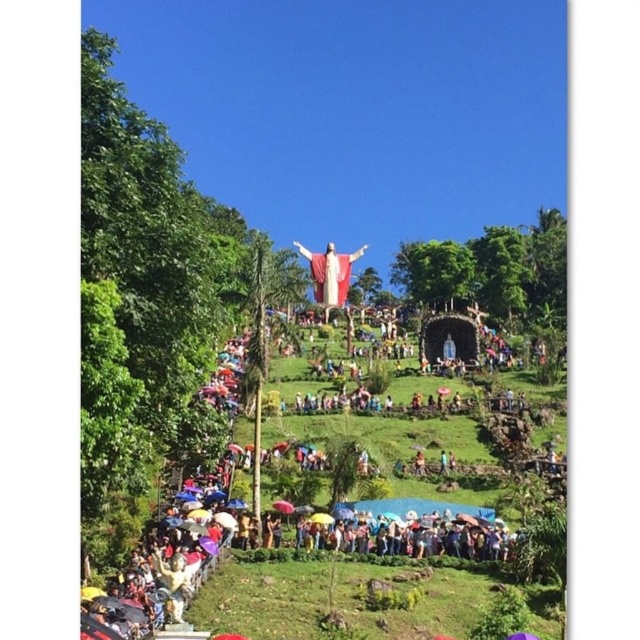
You are standing at the base of the hill where the statue of Jesus Christ is located. You want to join the gathering under the multicolored umbrellas at center. According to the coordinates provided, in which direction should you walk to reach them?

The multicolored umbrellas at center are located at coordinates point [429,547]. Since the x and y coordinates are both greater than 0.5, you should walk northeast to reach them.

You are a photographer trying to capture the entire scene of the polychrome statue at center and the multicolored umbrellas at center in one shot. Based on their sizes, which object will require you to adjust your camera angle to ensure both are fully visible?

The multicolored umbrellas at center have a greater width than the polychrome statue at center, so you will need to adjust your camera angle to accommodate their wider spread to ensure both are fully visible.

You are standing at point (346, 300) and want to walk to the statue of Jesus Christ at the top of the hill. There is an obstacle at point (444, 536). Which direction should you move to avoid the obstacle while heading towards the statue?

Since point (444, 536) is in front of point (346, 300), you should move around it by going either to the left or right to avoid the obstacle while heading towards the statue.